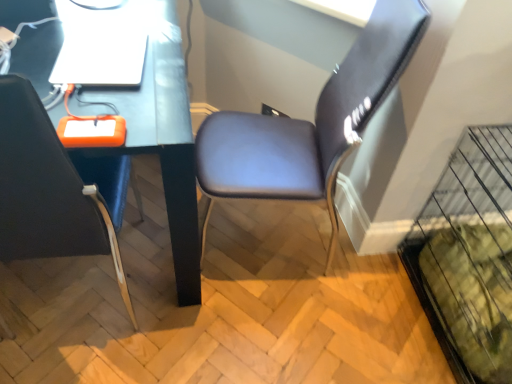
Find the location of `empty space that is ontop of matte black desk at center (from a real-world perspective)`. empty space that is ontop of matte black desk at center (from a real-world perspective) is located at coordinates (93, 37).